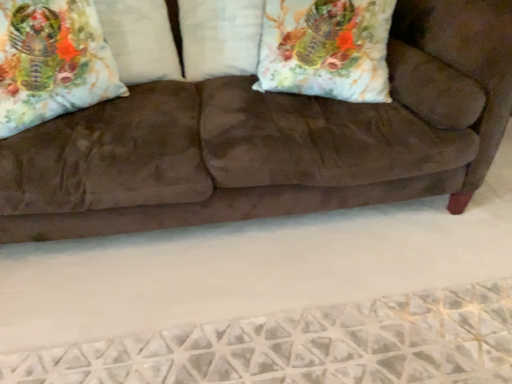
Question: Should I look upward or downward to see floral fabric pillow at upper left, the 2th throw pillow in the right-to-left sequence?

Choices:
 (A) up
 (B) down

Answer: (A)

Question: Considering the relative sizes of brown suede couch at center and floral fabric pillow at upper left, the second pillow in the right-to-left sequence, in the image provided, is brown suede couch at center smaller than floral fabric pillow at upper left, the second pillow in the right-to-left sequence,?

Choices:
 (A) yes
 (B) no

Answer: (B)

Question: Does brown suede couch at center contain floral fabric pillow at upper left, the second pillow in the right-to-left sequence?

Choices:
 (A) yes
 (B) no

Answer: (A)

Question: Is brown suede couch at center oriented away from floral fabric pillow at upper left, placed as the 1th pillow when sorted from left to right?

Choices:
 (A) no
 (B) yes

Answer: (B)

Question: Would you say brown suede couch at center is a long distance from floral fabric pillow at upper left, the second pillow in the right-to-left sequence?

Choices:
 (A) no
 (B) yes

Answer: (A)

Question: From the image's perspective, is brown suede couch at center under floral fabric pillow at upper left, placed as the 1th pillow when sorted from left to right?

Choices:
 (A) yes
 (B) no

Answer: (A)

Question: From the image's perspective, is brown suede couch at center above floral fabric pillow at upper left, placed as the 1th pillow when sorted from left to right?

Choices:
 (A) yes
 (B) no

Answer: (B)

Question: Is floral fabric pillow at upper right, positioned as the second throw pillow in left-to-right order, at the right side of satin white pillow at center, marked as the second pillow in a left-to-right arrangement?

Choices:
 (A) yes
 (B) no

Answer: (A)

Question: Is floral fabric pillow at upper right, positioned as the second throw pillow in left-to-right order, thinner than satin white pillow at center, marked as the second pillow in a left-to-right arrangement?

Choices:
 (A) no
 (B) yes

Answer: (A)

Question: Are floral fabric pillow at upper right, positioned as the second throw pillow in left-to-right order, and satin white pillow at center, marked as the first pillow in a right-to-left arrangement, far apart?

Choices:
 (A) yes
 (B) no

Answer: (B)

Question: From the image's perspective, is floral fabric pillow at upper right, positioned as the second throw pillow in left-to-right order, beneath satin white pillow at center, marked as the second pillow in a left-to-right arrangement?

Choices:
 (A) yes
 (B) no

Answer: (A)

Question: From the image's perspective, is floral fabric pillow at upper right, which is the first throw pillow from right to left, over satin white pillow at center, marked as the first pillow in a right-to-left arrangement?

Choices:
 (A) yes
 (B) no

Answer: (B)

Question: Does floral fabric pillow at upper right, which is the first throw pillow from right to left, lie in front of satin white pillow at center, marked as the second pillow in a left-to-right arrangement?

Choices:
 (A) yes
 (B) no

Answer: (A)

Question: Considering the relative sizes of brown suede couch at center and satin white pillow at center, marked as the second pillow in a left-to-right arrangement, in the image provided, is brown suede couch at center thinner than satin white pillow at center, marked as the second pillow in a left-to-right arrangement,?

Choices:
 (A) yes
 (B) no

Answer: (B)